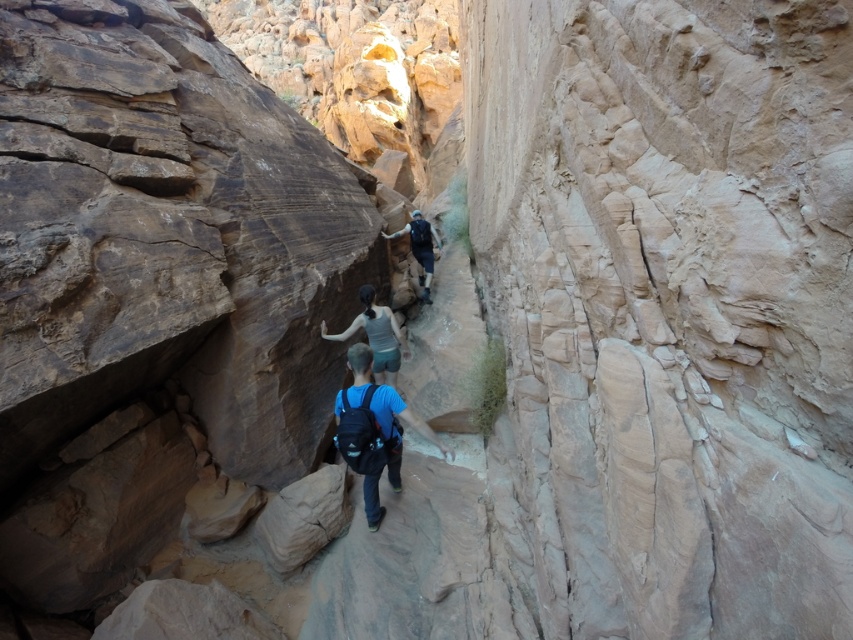
Does point (843, 602) come farther from viewer compared to point (398, 364)?

No, it is in front of (398, 364).

In order to click on smooth beige rock at center in this screenshot , I will do `click(672, 304)`.

From the picture: Can you confirm if smooth beige rock at center is positioned above blue fabric backpack at center?

Yes.

Can you confirm if smooth beige rock at center is shorter than blue fabric backpack at center?

Yes, smooth beige rock at center is shorter than blue fabric backpack at center.

Who is more forward, (790, 115) or (427, 436)?

Positioned in front is point (790, 115).

The width and height of the screenshot is (853, 640). I want to click on smooth beige rock at center, so click(x=672, y=304).

Is point (339, 422) positioned in front of point (326, 330)?

That is True.

Between blue fabric backpack at center and light blue fabric shirt at center, which one appears on the left side from the viewer's perspective?

light blue fabric shirt at center is more to the left.

At what (x,y) coordinates should I click in order to perform the action: click on blue fabric backpack at center. Please return your answer as a coordinate pair (x, y). Looking at the image, I should click on (381, 410).